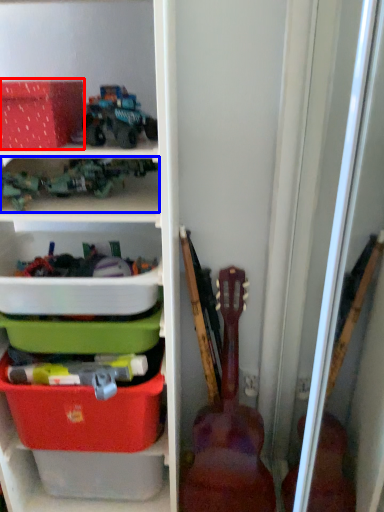
Question: Among these objects, which one is farthest to the camera, storage box (highlighted by a red box) or toy (highlighted by a blue box)?

Choices:
 (A) storage box
 (B) toy

Answer: (B)